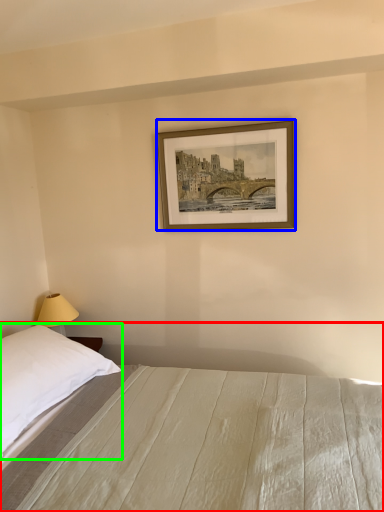
Question: Which object is the farthest from bed (highlighted by a red box)? Choose among these: picture frame (highlighted by a blue box) or pillow (highlighted by a green box).

Choices:
 (A) picture frame
 (B) pillow

Answer: (A)